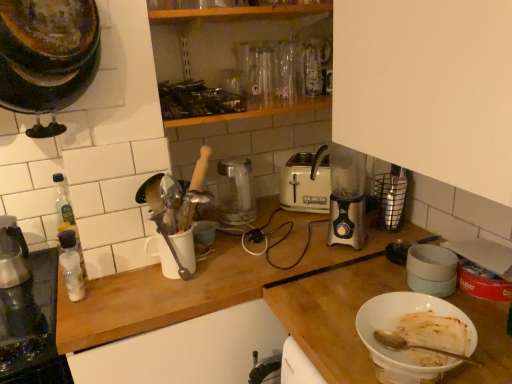
The image size is (512, 384). I want to click on space that is in front of white plastic toaster at center, so click(298, 223).